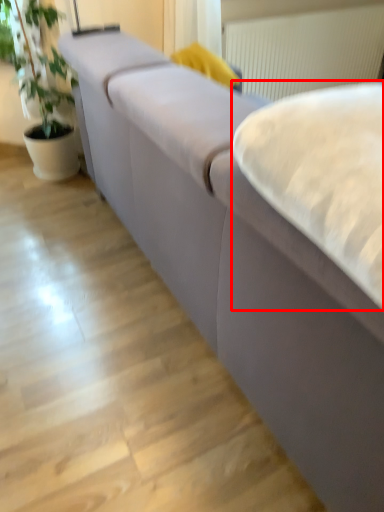
Question: From the image's perspective, what is the correct spatial relationship of sheet (annotated by the red box) in relation to radiator?

Choices:
 (A) above
 (B) below

Answer: (B)